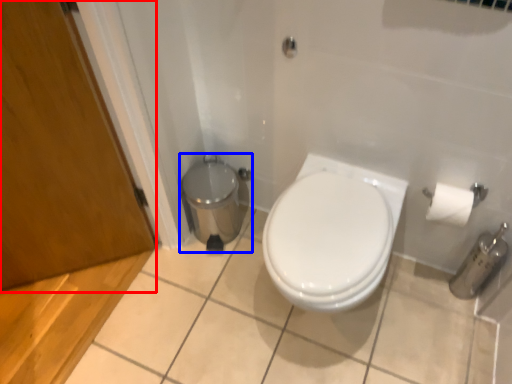
Question: Which object appears closest to the camera in this image, screen door (highlighted by a red box) or porcelain (highlighted by a blue box)?

Choices:
 (A) screen door
 (B) porcelain

Answer: (A)